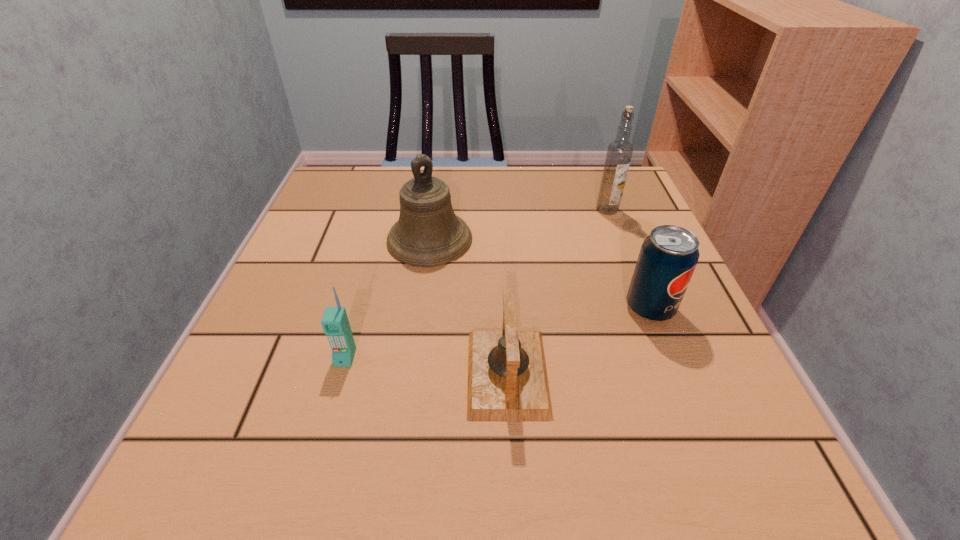
You are a GUI agent. You are given a task and a screenshot of the screen. Output one action in this format:
    pyautogui.click(x=<x>, y=<y>)
    Task: Click on the vacant area situated 0.090m on the keypad of the cellular telephone
    Image resolution: width=960 pixels, height=540 pixels.
    Given the screenshot: What is the action you would take?
    tap(327, 420)

Where is `free space located on the back of the shorter bell`? The height and width of the screenshot is (540, 960). free space located on the back of the shorter bell is located at coordinates (498, 210).

Identify the location of vodka at the far edge. (619, 152).

At what (x,y) coordinates should I click in order to perform the action: click on bell located at the far edge. Please return your answer as a coordinate pair (x, y). This screenshot has width=960, height=540. Looking at the image, I should click on (428, 233).

Find the location of `object located in the left edge section of the desktop`. object located in the left edge section of the desktop is located at coordinates (335, 323).

What are the coordinates of `vodka at the right edge` in the screenshot? It's located at (619, 152).

Identify the location of soda can situated at the right edge. The width and height of the screenshot is (960, 540). (668, 257).

Locate an element on the screen. object present at the far right corner is located at coordinates (619, 152).

Locate an element on the screen. vacant space at the far edge of the desktop is located at coordinates [x=471, y=188].

At what (x,y) coordinates should I click in order to perform the action: click on vacant space at the near edge of the desktop. Please return your answer as a coordinate pair (x, y). Image resolution: width=960 pixels, height=540 pixels. Looking at the image, I should click on (469, 463).